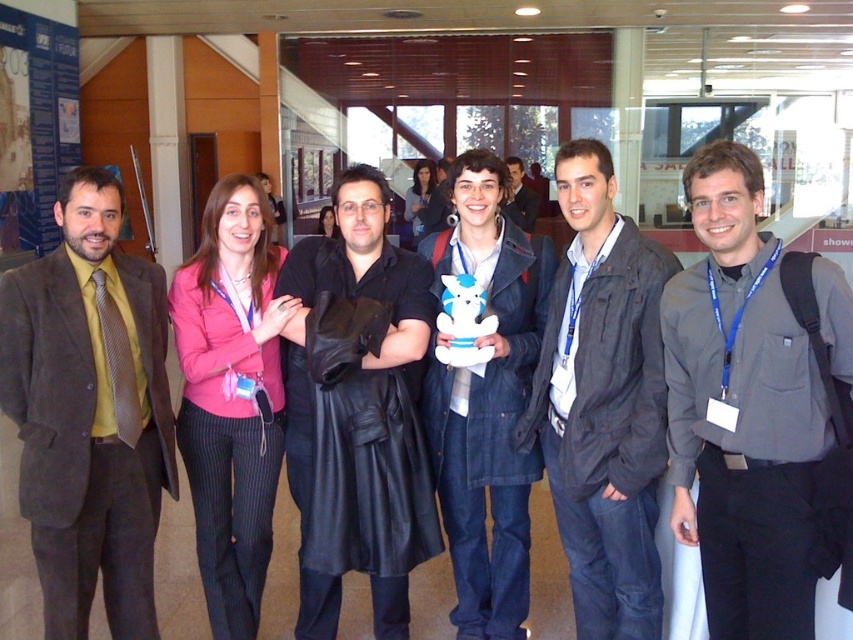
You are a photographer trying to adjust the framing of the group photo. The black leather coat at center is currently 2.13 meters away from the edge of the frame. Can you fit the entire group into the frame if you move the camera back by 1 meter?

The black leather coat at center is currently 2.13 meters away from the edge of the frame. Moving the camera back by 1 meter would increase the distance to 3.13 meters, allowing the entire group to fit into the frame.